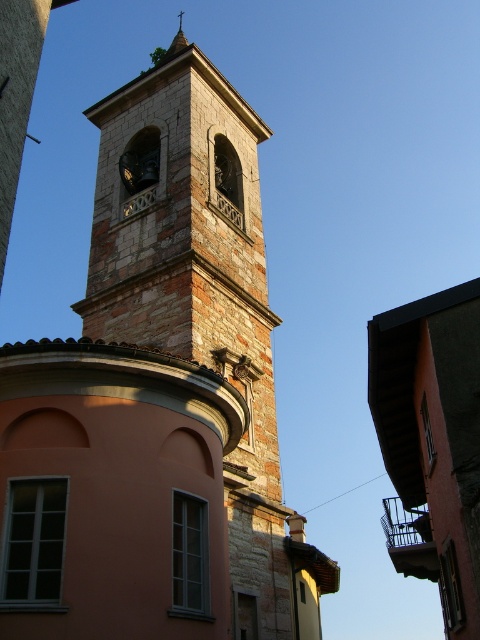
Question: Is stone bell tower at center to the left of smooth stone spire at upper center from the viewer's perspective?

Choices:
 (A) yes
 (B) no

Answer: (B)

Question: Considering the relative positions of stone bell tower at center and smooth stone spire at upper center in the image provided, where is stone bell tower at center located with respect to smooth stone spire at upper center?

Choices:
 (A) below
 (B) above

Answer: (A)

Question: Among these objects, which one is nearest to the camera?

Choices:
 (A) smooth stone spire at upper center
 (B) stone bell tower at center

Answer: (B)

Question: Is stone bell tower at center positioned before smooth stone spire at upper center?

Choices:
 (A) no
 (B) yes

Answer: (B)

Question: Which object is farther from the camera taking this photo?

Choices:
 (A) smooth stone spire at upper center
 (B) stone bell tower at center

Answer: (A)